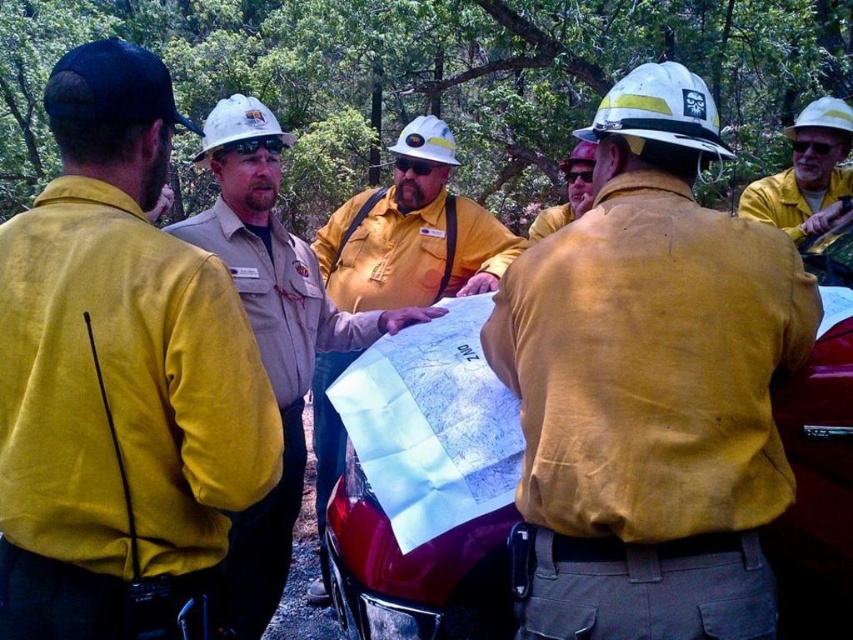
Does white hard hat at center appear on the right side of yellow fire-resistant jacket at center?

Incorrect, white hard hat at center is not on the right side of yellow fire-resistant jacket at center.

This screenshot has width=853, height=640. What do you see at coordinates (238, 124) in the screenshot? I see `white hard hat at center` at bounding box center [238, 124].

Where is `white hard hat at center`? The image size is (853, 640). white hard hat at center is located at coordinates (238, 124).

Where is `white hard hat at center`? The image size is (853, 640). white hard hat at center is located at coordinates (238, 124).

Does white hard hat at upper right have a lesser width compared to white matte hard hat at upper center?

In fact, white hard hat at upper right might be wider than white matte hard hat at upper center.

Who is more forward, (790,134) or (592,156)?

Positioned in front is point (592,156).

Does point (837, 108) come farther from viewer compared to point (589, 152)?

Yes, point (837, 108) is farther from viewer.

Where is `white hard hat at upper right`? The height and width of the screenshot is (640, 853). white hard hat at upper right is located at coordinates (822, 116).

Which is more to the right, matte yellow safety vest at center or black fabric cap at upper left?

matte yellow safety vest at center

Is matte yellow safety vest at center in front of black fabric cap at upper left?

No, it is not.

Describe the element at coordinates (410, 243) in the screenshot. I see `matte yellow safety vest at center` at that location.

I want to click on matte yellow safety vest at center, so click(410, 243).